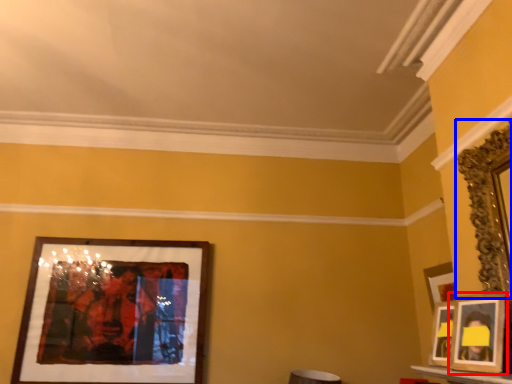
Question: Which point is closer to the camera, picture frame (highlighted by a red box) or picture frame (highlighted by a blue box)?

Choices:
 (A) picture frame
 (B) picture frame

Answer: (B)